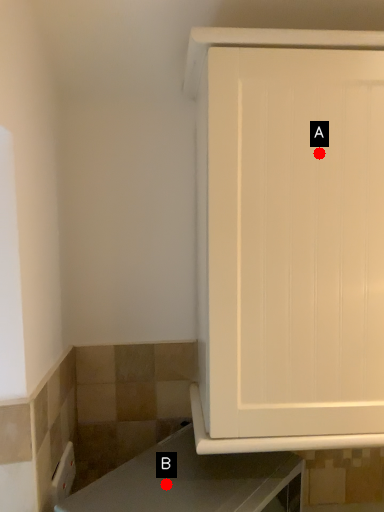
Question: Two points are circled on the image, labeled by A and B beside each circle. Which point is farther from the camera taking this photo?

Choices:
 (A) A is further
 (B) B is further

Answer: (B)